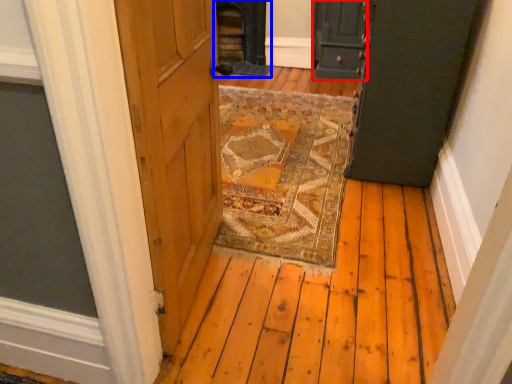
Question: Which object is closer to the camera taking this photo, door (highlighted by a red box) or fireplace (highlighted by a blue box)?

Choices:
 (A) door
 (B) fireplace

Answer: (A)